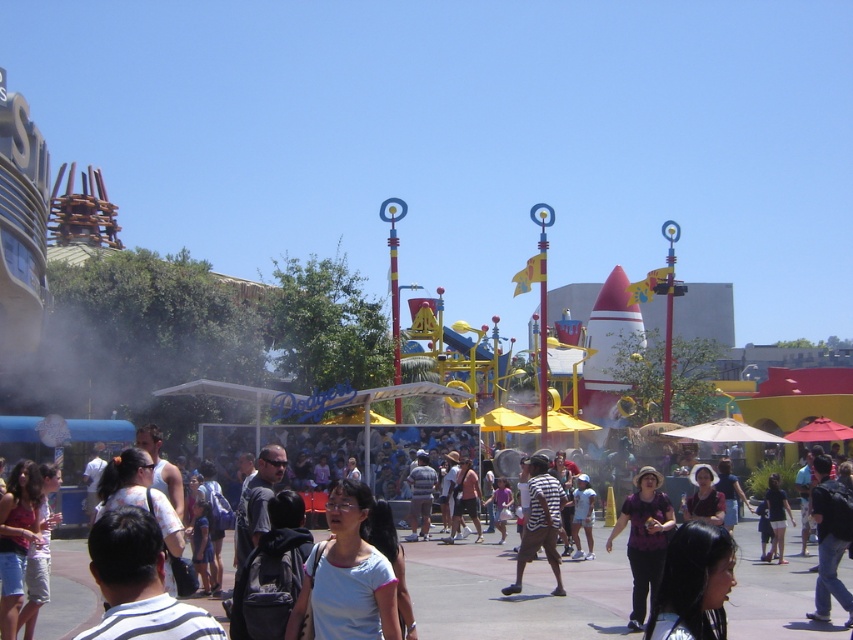
Question: Among these points, which one is nearest to the camera?

Choices:
 (A) (363, 628)
 (B) (541, 541)
 (C) (659, 474)

Answer: (A)

Question: Where is purple matte shirt at center located in relation to striped fabric shirt at center in the image?

Choices:
 (A) below
 (B) above

Answer: (A)

Question: Which of the following is the farthest from the observer?

Choices:
 (A) matte white crowd at center
 (B) striped fabric shirt at center
 (C) purple matte shirt at center
 (D) white matte shirt at center

Answer: (B)

Question: Which object is the farthest from the purple matte shirt at center?

Choices:
 (A) matte white crowd at center
 (B) white matte shirt at center
 (C) striped fabric shirt at center

Answer: (B)

Question: In this image, where is matte white crowd at center located relative to striped fabric shirt at center?

Choices:
 (A) right
 (B) left

Answer: (B)

Question: Can you confirm if white matte shirt at center is positioned to the left of striped fabric shirt at center?

Choices:
 (A) yes
 (B) no

Answer: (A)